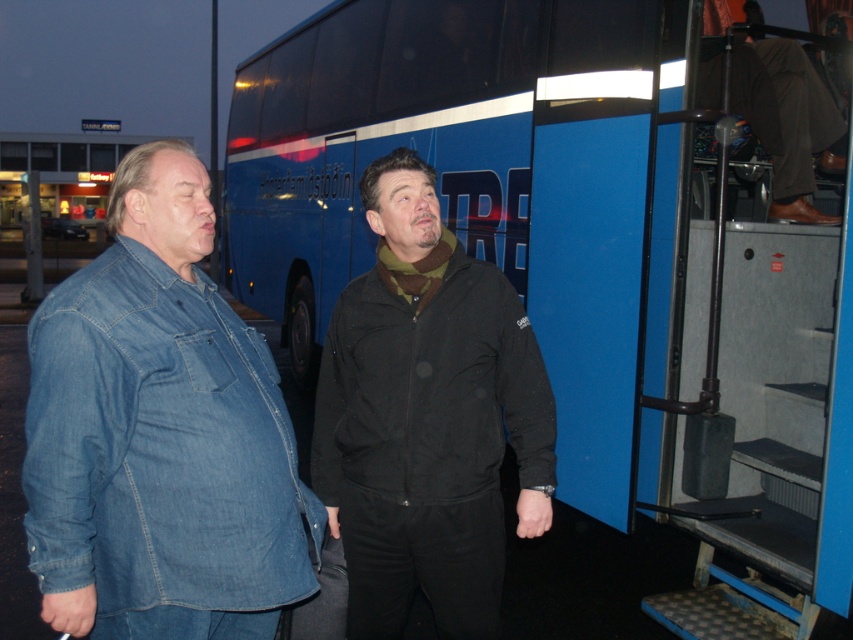
Is denim jacket at left smaller than black textured jacket at center?

No, denim jacket at left is not smaller than black textured jacket at center.

Can you confirm if denim jacket at left is positioned below black textured jacket at center?

No.

Who is more distant from viewer, (114, 545) or (543, 410)?

The point (543, 410) is more distant.

Identify the location of denim jacket at left. (160, 435).

What do you see at coordinates (427, 417) in the screenshot? I see `black textured jacket at center` at bounding box center [427, 417].

Can you confirm if black textured jacket at center is positioned to the right of brown leather jacket at upper right?

No, black textured jacket at center is not to the right of brown leather jacket at upper right.

Find the location of a particular element. This screenshot has width=853, height=640. black textured jacket at center is located at coordinates (427, 417).

You are a GUI agent. You are given a task and a screenshot of the screen. Output one action in this format:
    pyautogui.click(x=<x>, y=<y>)
    Task: Click on the black textured jacket at center
    This screenshot has height=640, width=853.
    Given the screenshot: What is the action you would take?
    pyautogui.click(x=427, y=417)

Between denim jacket at left and brown leather jacket at upper right, which one appears on the right side from the viewer's perspective?

brown leather jacket at upper right

Is point (38, 490) farther from viewer compared to point (824, 141)?

No, (38, 490) is in front of (824, 141).

Which is behind, point (239, 596) or point (746, 120)?

Positioned behind is point (746, 120).

I want to click on denim jacket at left, so click(x=160, y=435).